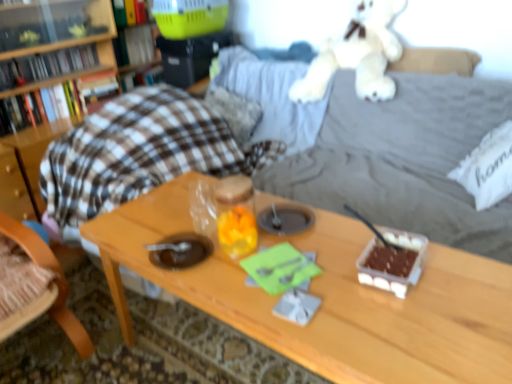
Question: From a real-world perspective, is wooden table at center positioned over wooden chair at left based on gravity?

Choices:
 (A) yes
 (B) no

Answer: (B)

Question: Is wooden table at center wider than wooden chair at left?

Choices:
 (A) no
 (B) yes

Answer: (A)

Question: Considering the relative sizes of wooden table at center and wooden chair at left in the image provided, is wooden table at center taller than wooden chair at left?

Choices:
 (A) yes
 (B) no

Answer: (A)

Question: From a real-world perspective, is wooden table at center beneath wooden chair at left?

Choices:
 (A) yes
 (B) no

Answer: (A)

Question: Are wooden table at center and wooden chair at left making contact?

Choices:
 (A) no
 (B) yes

Answer: (A)

Question: Considering the positions of point (12, 72) and point (120, 59), is point (12, 72) closer or farther from the camera than point (120, 59)?

Choices:
 (A) closer
 (B) farther

Answer: (A)

Question: Is hardcover book at upper left, the 3th book positioned from the top, inside or outside of green plastic book at upper center, arranged as the third book when ordered from the bottom?

Choices:
 (A) outside
 (B) inside

Answer: (A)

Question: Considering the positions of hardcover book at upper left, which is the second book from bottom to top, and green plastic book at upper center, arranged as the third book when ordered from the bottom, in the image, is hardcover book at upper left, which is the second book from bottom to top, wider or thinner than green plastic book at upper center, arranged as the third book when ordered from the bottom,?

Choices:
 (A) thin
 (B) wide

Answer: (A)

Question: Considering the positions of hardcover book at upper left, which is the second book from bottom to top, and green plastic book at upper center, arranged as the third book when ordered from the bottom, in the image, is hardcover book at upper left, which is the second book from bottom to top, bigger or smaller than green plastic book at upper center, arranged as the third book when ordered from the bottom,?

Choices:
 (A) big
 (B) small

Answer: (B)

Question: Considering the positions of hardcover book at upper left, which is counted as the fourth book, starting from the bottom, and hardcover book at upper left, which is the second book from bottom to top, in the image, is hardcover book at upper left, which is counted as the fourth book, starting from the bottom, bigger or smaller than hardcover book at upper left, which is the second book from bottom to top,?

Choices:
 (A) small
 (B) big

Answer: (B)

Question: From a real-world perspective, relative to hardcover book at upper left, the 3th book positioned from the top, is hardcover book at upper left, which is counted as the fourth book, starting from the bottom, vertically above or below?

Choices:
 (A) below
 (B) above

Answer: (B)

Question: From the image's perspective, is hardcover book at upper left, which is counted as the fourth book, starting from the bottom, positioned above or below hardcover book at upper left, which is the second book from bottom to top?

Choices:
 (A) above
 (B) below

Answer: (A)

Question: Considering the positions of point (132, 21) and point (41, 56), is point (132, 21) closer or farther from the camera than point (41, 56)?

Choices:
 (A) farther
 (B) closer

Answer: (A)

Question: Is hardcover book at upper left, which is counted as the fourth book, starting from the bottom, inside the boundaries of white fabric pillow at right, or outside?

Choices:
 (A) inside
 (B) outside

Answer: (B)

Question: From a real-world perspective, is hardcover book at upper left, which is counted as the fourth book, starting from the bottom, physically located above or below white fabric pillow at right?

Choices:
 (A) above
 (B) below

Answer: (A)